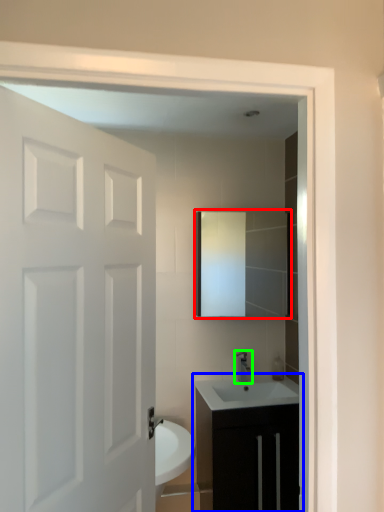
Question: Based on their relative distances, which object is farther from mirror (highlighted by a red box)? Choose from bathroom cabinet (highlighted by a blue box) and tap (highlighted by a green box).

Choices:
 (A) bathroom cabinet
 (B) tap

Answer: (A)